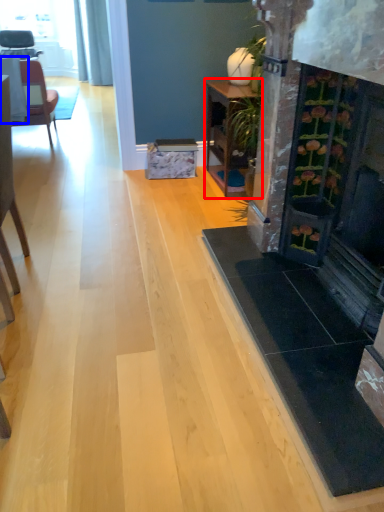
Question: Among these objects, which one is farthest to the camera, table (highlighted by a red box) or table (highlighted by a blue box)?

Choices:
 (A) table
 (B) table

Answer: (B)